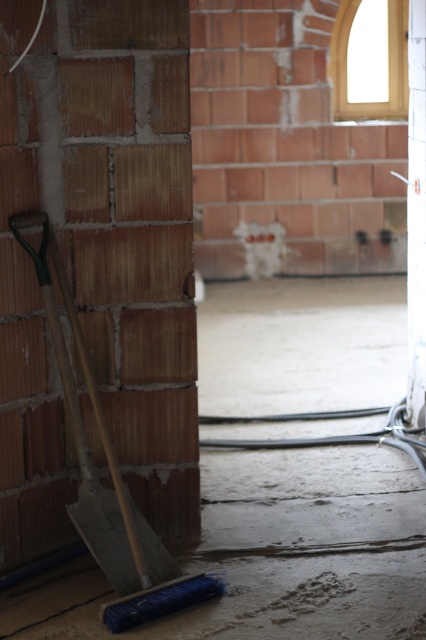
You are standing in the construction area and need to move from point A to point B. Point A is at coordinates point (x=261, y=545) and point B is at coordinates point (x=86, y=532). Which point is closer to you when you start at point A?

Point B at coordinates point (x=86, y=532) is closer to you because it is nearer to the camera compared to point A at coordinates point (x=261, y=545).

You are a construction worker needing to move the blue bristle broom at left to the white glossy pillar at center. Given that the cables on the floor are 1.5 meters wide, can you safely move the broom without stepping on the cables?

The blue bristle broom at left and white glossy pillar at center are 1.80 meters apart. The cables are 1.5 meters wide, so there is a 0.3 meter gap between them. This gap is narrow but sufficient to carefully move the broom without stepping on the cables.

You are a construction worker standing at the entrance of the construction site. You see two points marked on the floor, point 1 at coordinates point (118, 538) and point 2 at coordinates point (422, 304). Which point is closer to you?

Point (118, 538) is closer to the camera than point (422, 304), so point 1 is closer to you.